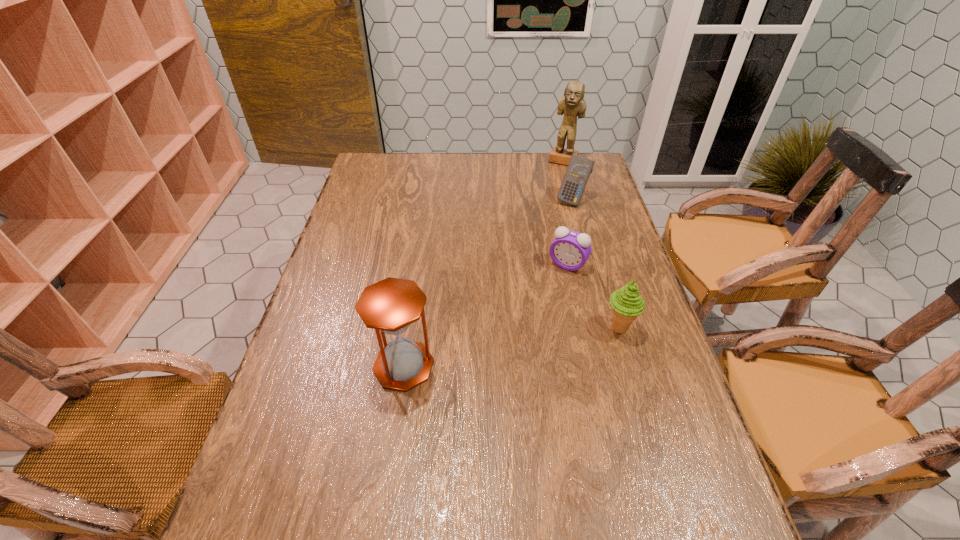
At what (x,y) coordinates should I click in order to perform the action: click on blank space that satisfies the following two spatial constraints: 1. on the back side of the shortest object; 2. on the left side of the farthest object. Please return your answer as a coordinate pair (x, y). Looking at the image, I should click on (545, 161).